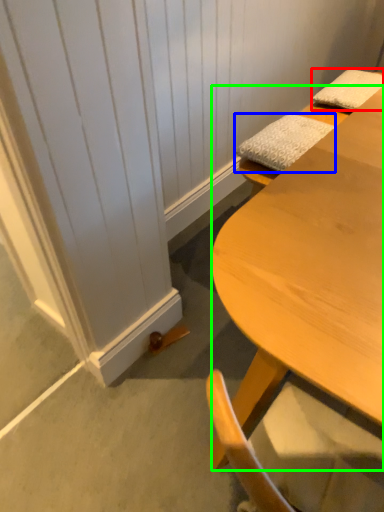
Question: Which is farther away from pillow (highlighted by a red box)? pillow (highlighted by a blue box) or desk (highlighted by a green box)?

Choices:
 (A) pillow
 (B) desk

Answer: (B)